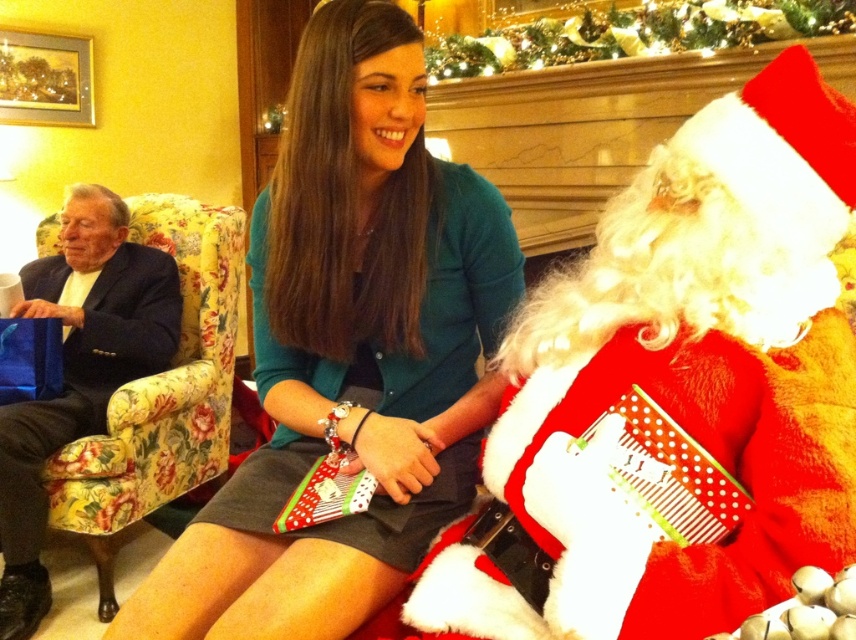
Who is more forward, (736, 422) or (556, 35)?

Point (736, 422) is in front.

Is red velvet santa at center further to the viewer compared to shiny gold ornaments at upper center?

That is False.

Locate an element on the screen. Image resolution: width=856 pixels, height=640 pixels. red velvet santa at center is located at coordinates (676, 394).

Who is shorter, teal sweater at center or shiny gold ornaments at upper center?

shiny gold ornaments at upper center is shorter.

Is point (308, 573) behind point (627, 19)?

No, it is not.

Is point (488, 388) closer to camera compared to point (473, 36)?

Yes.

You are a GUI agent. You are given a task and a screenshot of the screen. Output one action in this format:
    pyautogui.click(x=<x>, y=<y>)
    Task: Click on the teal sweater at center
    
    Given the screenshot: What is the action you would take?
    pyautogui.click(x=349, y=348)

Is red velvet santa at center positioned at the back of teal sweater at center?

No, it is not.

Does point (716, 568) come farther from viewer compared to point (387, 38)?

No, it is not.

Identify the location of red velvet santa at center. (676, 394).